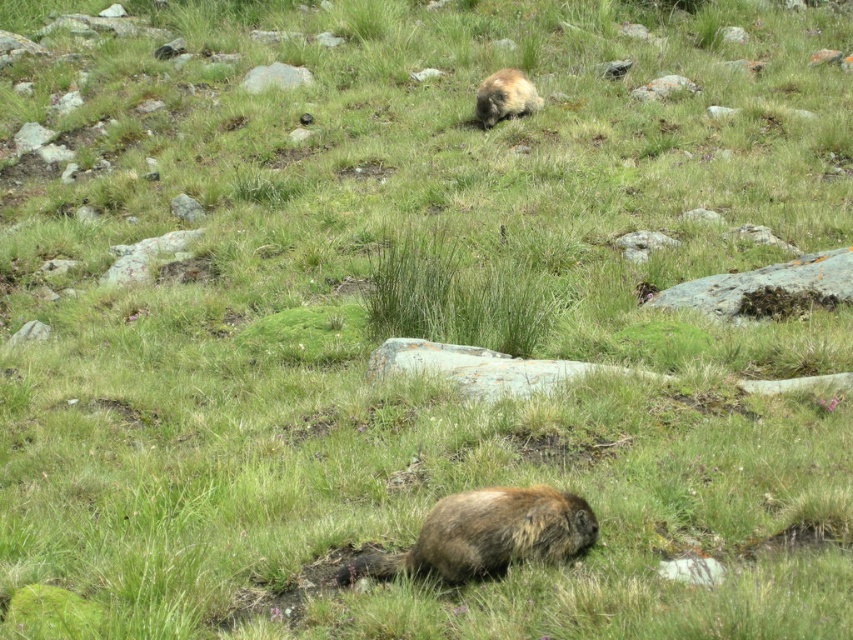
From the picture: You are a hiker who wants to place a small marker at point (486, 534). The marker is 10 cm in diameter. Is there enough space at that point to place the marker without overlapping the brown furry groundhog at lower center?

The brown furry groundhog at lower center is located at point (486, 534), so placing a 10 cm diameter marker there would overlap with the groundhog. Choose another spot.

You are a hiker trying to locate two animals in the scene. You see the brown furry groundhog at lower center and the fuzzy brown animal at upper center. Which animal is located to the left of the other?

The brown furry groundhog at lower center is positioned on the left side of the fuzzy brown animal at upper center.